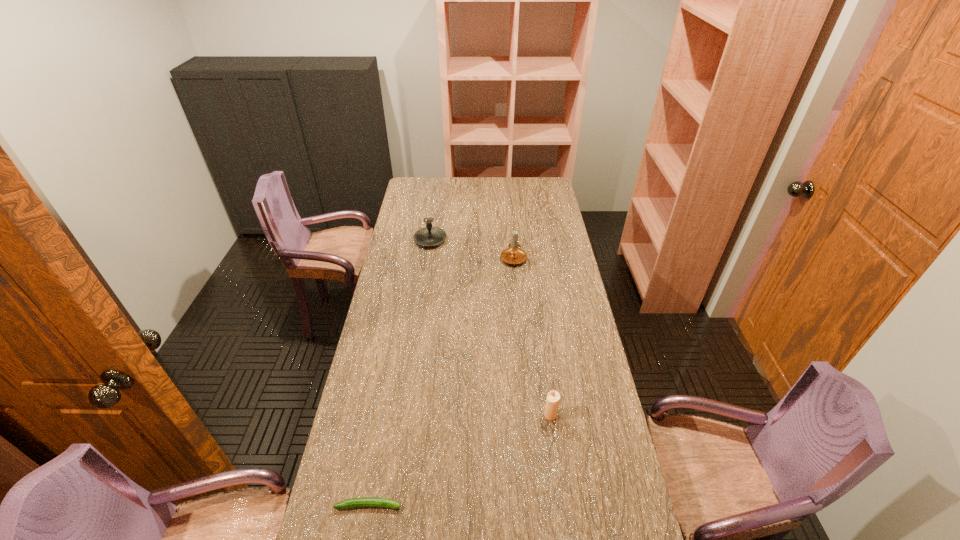
You are a GUI agent. You are given a task and a screenshot of the screen. Output one action in this format:
    pyautogui.click(x=<x>, y=<y>)
    Task: Click on the second closest candle to the third nearest object
    
    Given the screenshot: What is the action you would take?
    pyautogui.click(x=553, y=398)

Where is `the second closest candle to the shortest candle`? This screenshot has height=540, width=960. the second closest candle to the shortest candle is located at coordinates (429, 236).

Locate an element on the screen. The image size is (960, 540). vacant space that satisfies the following two spatial constraints: 1. on the front side of the nearest candle; 2. on the front-facing side of the nearest object is located at coordinates (563, 505).

The width and height of the screenshot is (960, 540). What are the coordinates of `free space that satisfies the following two spatial constraints: 1. on the front side of the leftmost candle; 2. on the right side of the nearest candle` in the screenshot? It's located at (405, 415).

Find the location of a particular element. The image size is (960, 540). vacant space that satisfies the following two spatial constraints: 1. on the front side of the nearest candle; 2. on the right side of the second nearest candle is located at coordinates (533, 415).